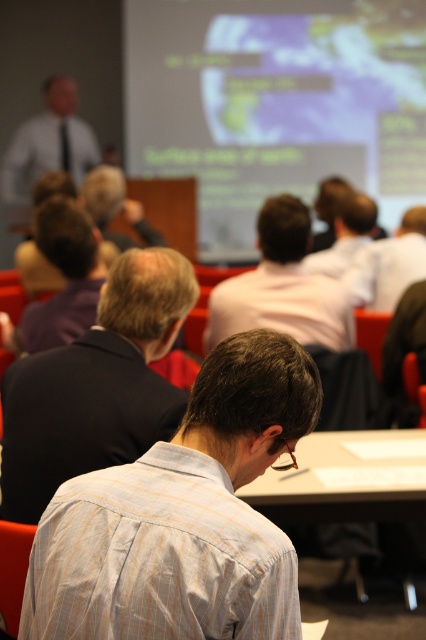
Does point (328, 342) come behind point (307, 257)?

No, it is not.

In order to click on light brown shirt at center in this screenshot , I will do `click(282, 288)`.

Between matte projector screen at upper center and white shirt at upper center, which one is positioned lower?

white shirt at upper center

Does matte projector screen at upper center lie in front of white shirt at upper center?

No.

Is point (227, 60) farther from camera compared to point (408, 260)?

That is True.

The height and width of the screenshot is (640, 426). What are the coordinates of `matte projector screen at upper center` in the screenshot? It's located at pos(275,104).

Does white shirt at left lie in front of matte white shirt at center?

No, white shirt at left is behind matte white shirt at center.

The height and width of the screenshot is (640, 426). Describe the element at coordinates (48, 144) in the screenshot. I see `white shirt at left` at that location.

Is point (51, 138) positioned in front of point (340, 205)?

No, (51, 138) is further to viewer.

Identify the location of white shirt at left. The image size is (426, 640). (48, 144).